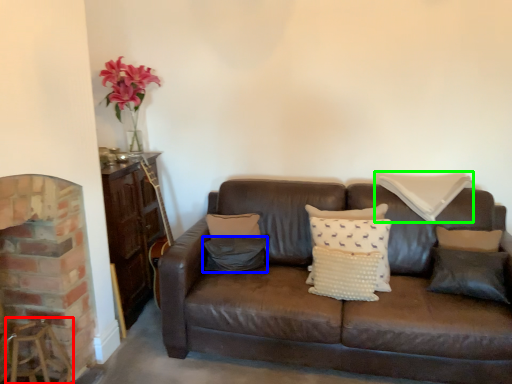
Question: Estimate the real-world distances between objects in this image. Which object is closer to bar stool (highlighted by a red box), pillow (highlighted by a blue box) or pillow (highlighted by a green box)?

Choices:
 (A) pillow
 (B) pillow

Answer: (A)